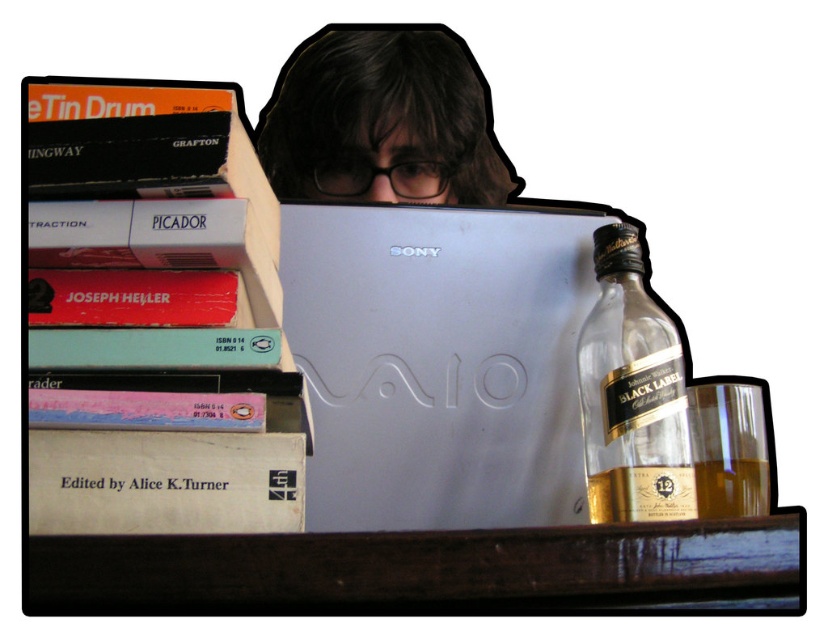
Question: Is silver metallic laptop at center positioned behind brown wooden table at lower center?

Choices:
 (A) yes
 (B) no

Answer: (A)

Question: Does brown wooden table at lower center have a lesser width compared to golden glass bottle at right?

Choices:
 (A) no
 (B) yes

Answer: (A)

Question: Which object is closer to the camera taking this photo?

Choices:
 (A) clear glass bottle at right
 (B) brown wooden table at lower center

Answer: (B)

Question: Which of the following is the farthest from the observer?

Choices:
 (A) (326, 257)
 (B) (71, 579)
 (C) (473, 74)

Answer: (C)

Question: Considering the relative positions of silver metallic laptop at center and golden glass bottle at right in the image provided, where is silver metallic laptop at center located with respect to golden glass bottle at right?

Choices:
 (A) right
 (B) left

Answer: (B)

Question: Which point is closer to the camera taking this photo?

Choices:
 (A) (504, 225)
 (B) (47, 436)

Answer: (B)